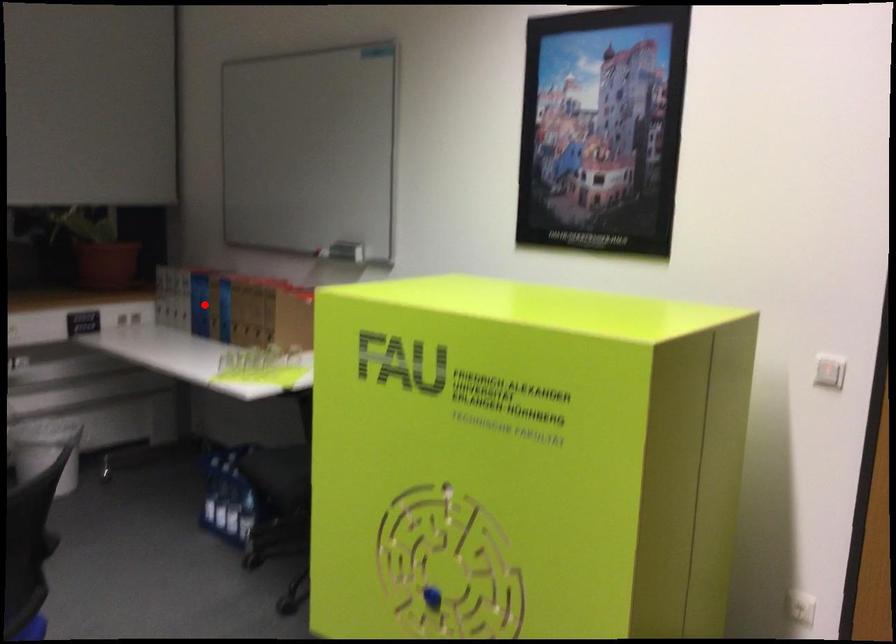
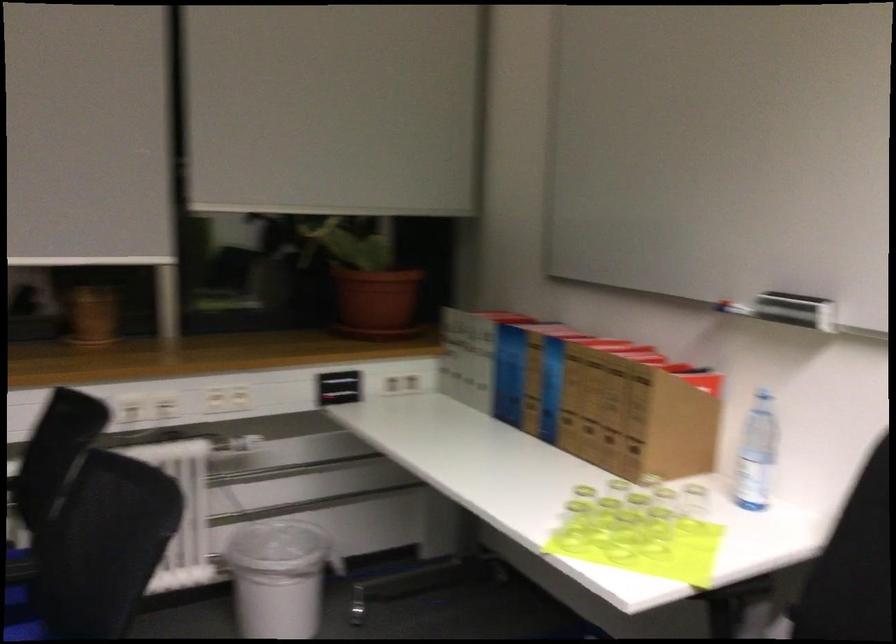
Find the pixel in the second image that matches the highlighted location in the first image.

(509, 374)